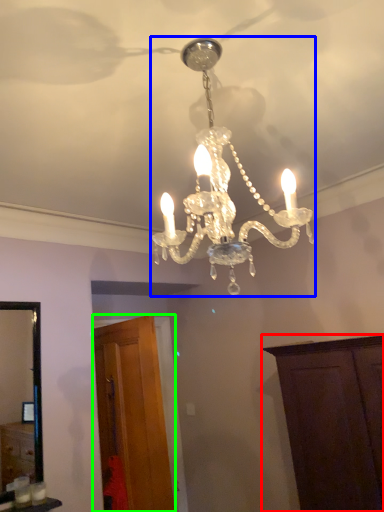
Question: Based on their relative distances, which object is farther from cabinetry (highlighted by a red box)? Choose from lamp (highlighted by a blue box) and cabinetry (highlighted by a green box).

Choices:
 (A) lamp
 (B) cabinetry

Answer: (A)